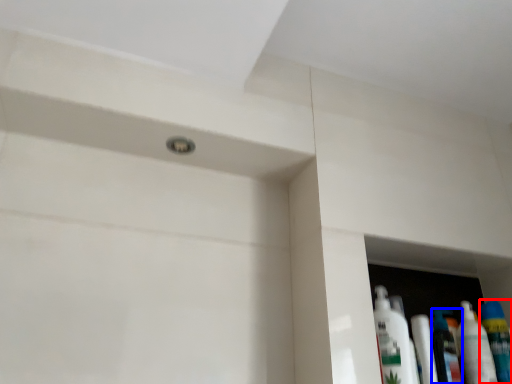
Question: Which object appears closest to the camera in this image, mouthwash (highlighted by a red box) or mouthwash (highlighted by a blue box)?

Choices:
 (A) mouthwash
 (B) mouthwash

Answer: (A)